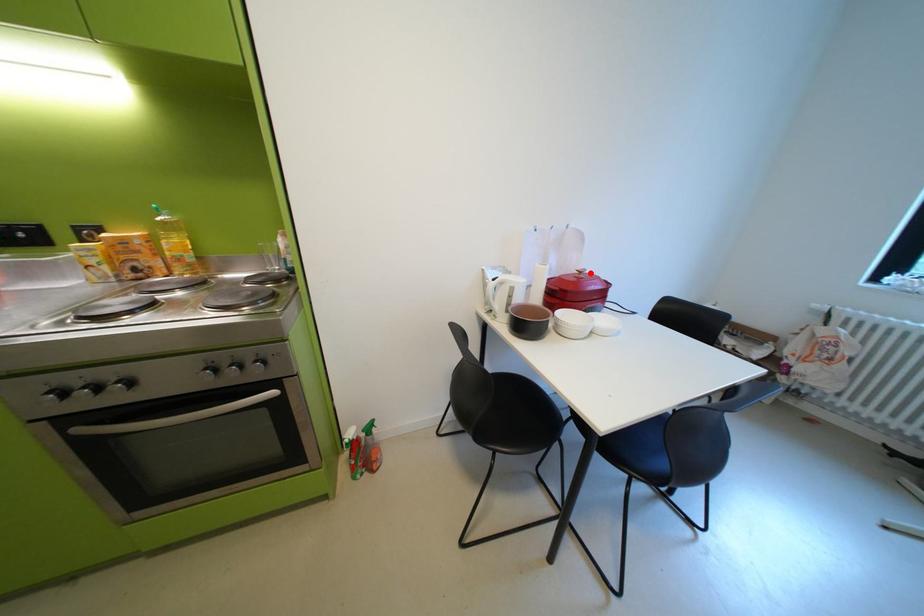
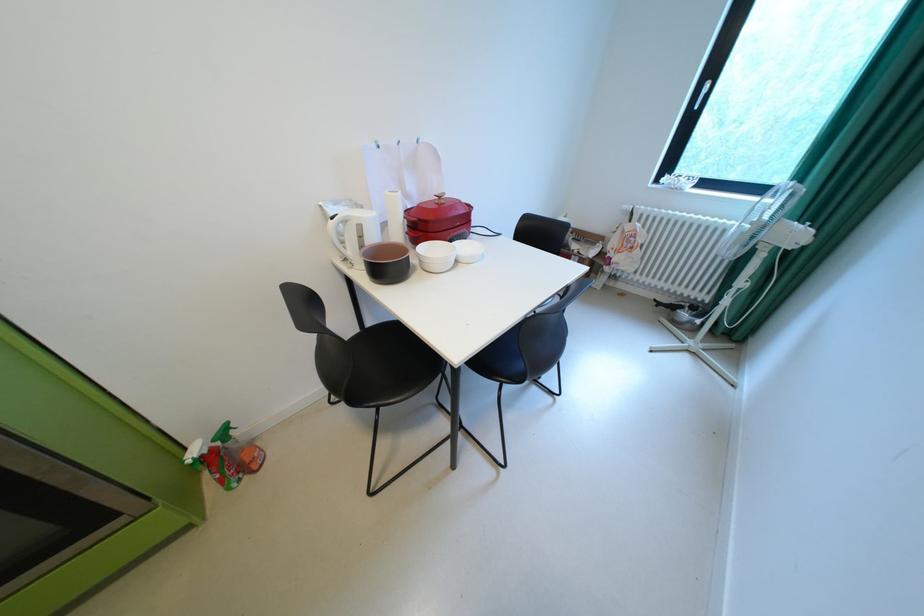
Find the pixel in the second image that matches the highlighted location in the first image.

(450, 198)